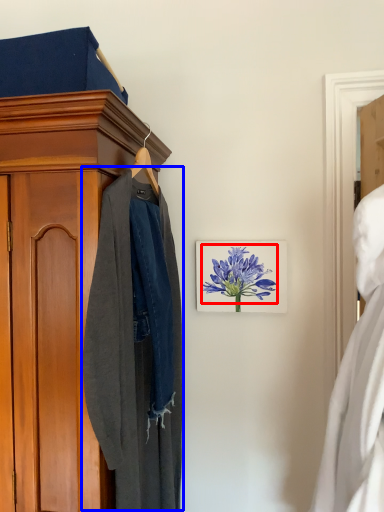
Question: Which point is closer to the camera, flower (highlighted by a red box) or clothing (highlighted by a blue box)?

Choices:
 (A) flower
 (B) clothing

Answer: (B)